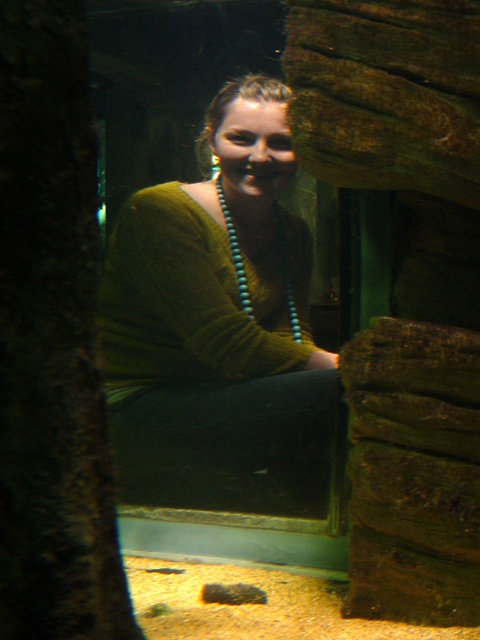
You are an interior designer planning to place a decorative item at point 0.5, 0.45 in the aquarium. There is a green matte sweater at center. Will the decorative item overlap with the sweater?

The green matte sweater at center is located at point (218, 328), which is very close to the desired placement point (216, 320). The distance between them is minimal, so there might be an overlap depending on the size of the decorative item. However, since the exact size isn not provided, it is safer to assume potential overlap.

You are a photographer positioned outside the aquarium enclosure. You want to take a photo of the person wearing the green matte sweater at center and the turquoise beads at center. Which object will appear larger in your photo?

The green matte sweater at center will appear larger in the photo because it is closer to the viewer than the turquoise beads at center.